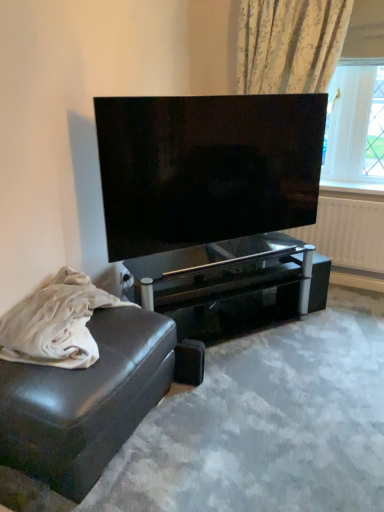
This screenshot has width=384, height=512. In order to click on blank space above white glossy radiator at upper right (from a real-world perspective) in this screenshot , I will do `click(344, 197)`.